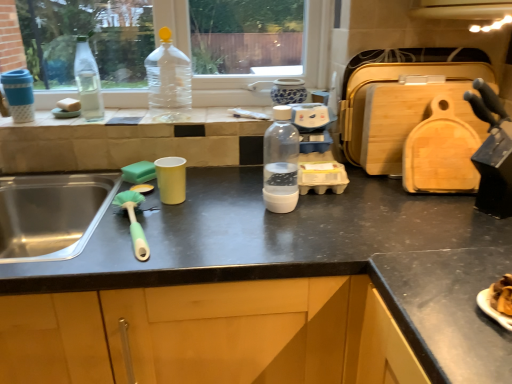
Identify the location of vacant area situated to the left side of transparent plastic bottle at upper center, the second bottle when ordered from left to right. The width and height of the screenshot is (512, 384). (x=120, y=115).